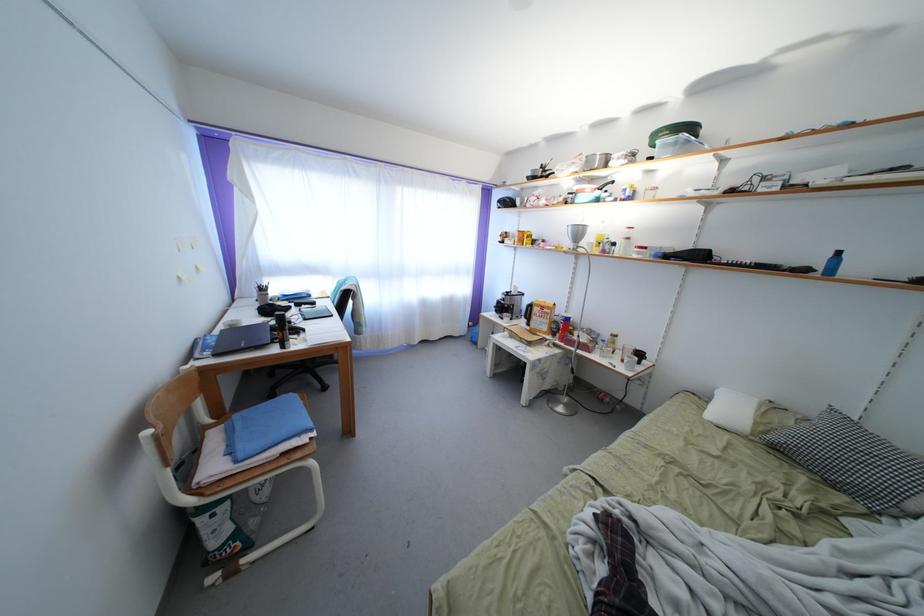
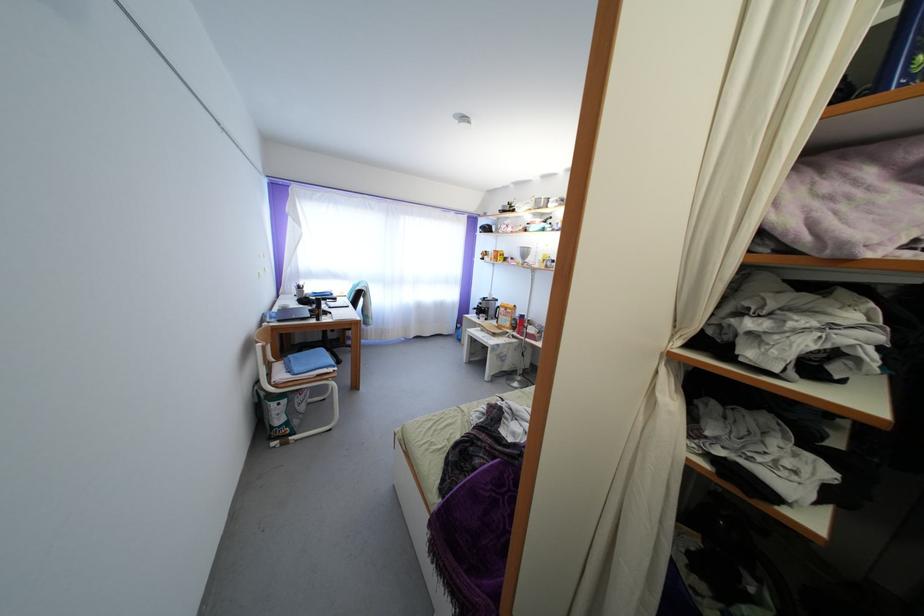
The images are taken continuously from a first-person perspective. In which direction are you moving?

The cameraman walked toward right, backward.